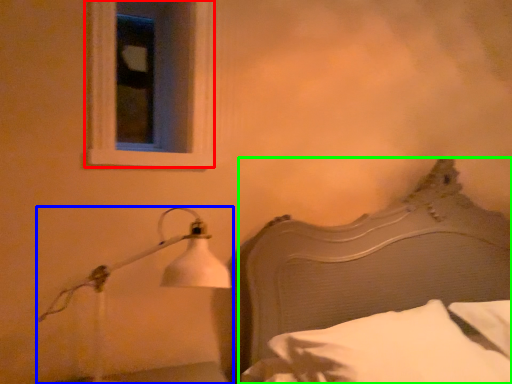
Question: Based on their relative distances, which object is farther from window (highlighted by a red box)? Choose from lamp (highlighted by a blue box) and bed (highlighted by a green box).

Choices:
 (A) lamp
 (B) bed

Answer: (B)